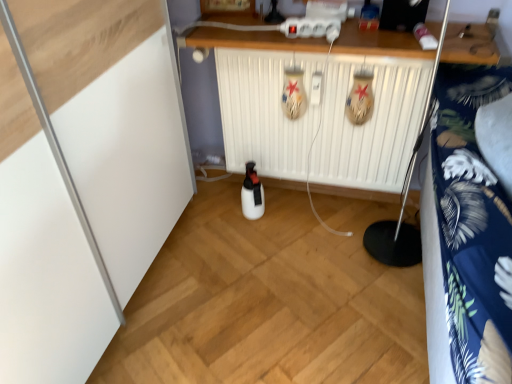
Question: Considering their positions, is blue floral fabric at right located in front of or behind white wood counter at upper center?

Choices:
 (A) front
 (B) behind

Answer: (A)

Question: Considering the positions of blue floral fabric at right and white wood counter at upper center in the image, is blue floral fabric at right bigger or smaller than white wood counter at upper center?

Choices:
 (A) small
 (B) big

Answer: (B)

Question: Which object is the farthest from the blue floral fabric at right?

Choices:
 (A) white plastic radiator at center
 (B) white wood counter at upper center

Answer: (A)

Question: Considering the real-world distances, which object is farthest from the white plastic radiator at center?

Choices:
 (A) blue floral fabric at right
 (B) white wood counter at upper center

Answer: (A)